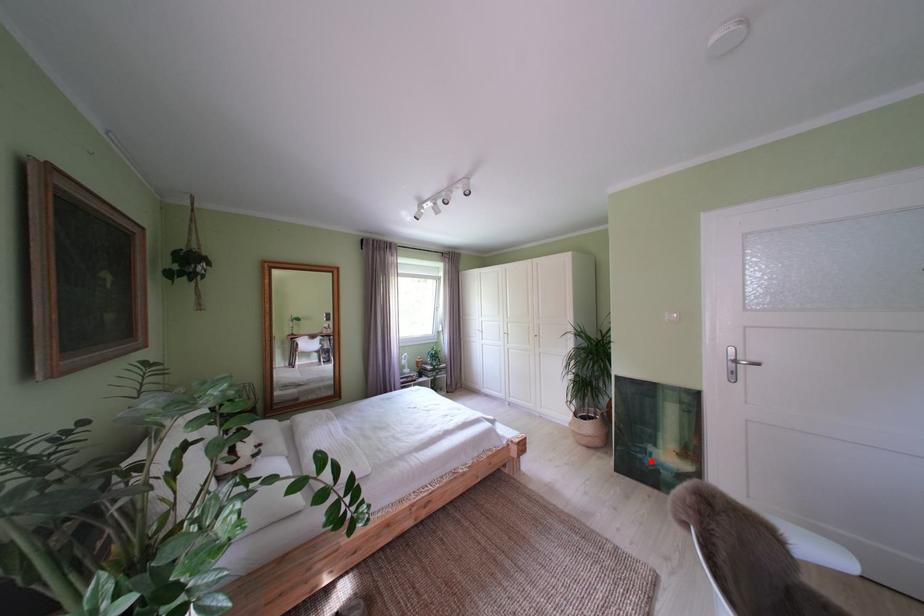
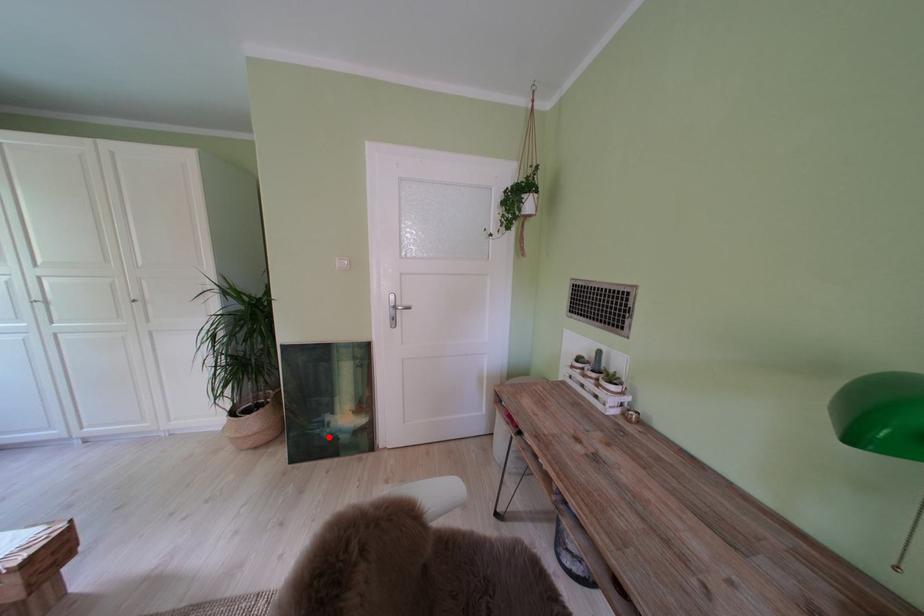
I am providing you with two images of the same scene from different viewpoints. A red point is marked on the first image and another point is marked on the second image. Is the marked point in image1 the same physical position as the marked point in image2?

Yes